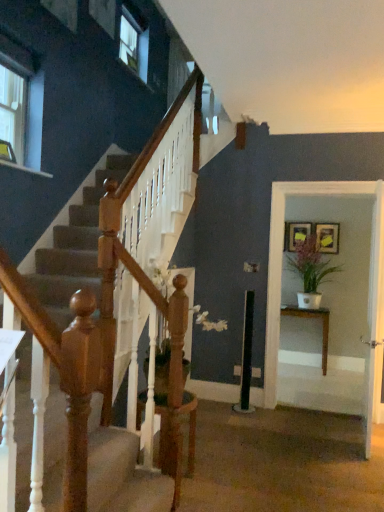
Question: Considering the relative sizes of wooden table at right and matte gold picture frame at upper right, which is the first picture frame in left-to-right order, in the image provided, is wooden table at right smaller than matte gold picture frame at upper right, which is the first picture frame in left-to-right order,?

Choices:
 (A) no
 (B) yes

Answer: (A)

Question: Would you say wooden table at right is a long distance from matte gold picture frame at upper right, which is the first picture frame in left-to-right order?

Choices:
 (A) yes
 (B) no

Answer: (A)

Question: Are wooden table at right and matte gold picture frame at upper right, which is the first picture frame in left-to-right order, making contact?

Choices:
 (A) yes
 (B) no

Answer: (B)

Question: Does wooden table at right have a larger size compared to matte gold picture frame at upper right, the 2th picture frame in the right-to-left sequence?

Choices:
 (A) no
 (B) yes

Answer: (B)

Question: Can you confirm if wooden table at right is thinner than matte gold picture frame at upper right, the 2th picture frame in the right-to-left sequence?

Choices:
 (A) no
 (B) yes

Answer: (A)

Question: From the image's perspective, is wooden table at right located beneath matte gold picture frame at upper right, which is the first picture frame in left-to-right order?

Choices:
 (A) yes
 (B) no

Answer: (A)

Question: Is white glossy table at right further to camera compared to white glossy door at center?

Choices:
 (A) no
 (B) yes

Answer: (B)

Question: From a real-world perspective, is white glossy table at right beneath white glossy door at center?

Choices:
 (A) no
 (B) yes

Answer: (A)

Question: Is white glossy table at right at the right side of white glossy door at center?

Choices:
 (A) yes
 (B) no

Answer: (B)

Question: Is white glossy table at right wider than white glossy door at center?

Choices:
 (A) no
 (B) yes

Answer: (B)

Question: Considering the relative sizes of white glossy table at right and white glossy door at center in the image provided, is white glossy table at right taller than white glossy door at center?

Choices:
 (A) no
 (B) yes

Answer: (B)

Question: Is white glossy table at right shorter than white glossy door at center?

Choices:
 (A) yes
 (B) no

Answer: (B)

Question: From a real-world perspective, is green matte plant at right located higher than matte gold picture frame at upper right, the 2th picture frame in the right-to-left sequence?

Choices:
 (A) yes
 (B) no

Answer: (B)